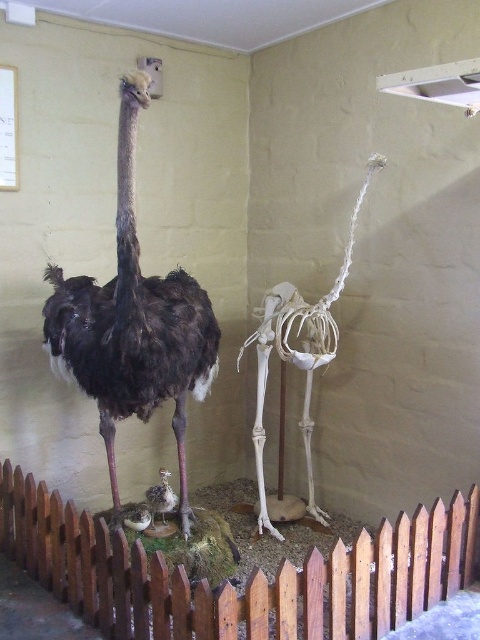
You are a gardener who needs to trim the brown wooden picket fence at lower center. However, you notice the dark brown feathers at center nearby. Which object is closer to the ground? Please state the name of the object closer to the ground.

The brown wooden picket fence at lower center is positioned under dark brown feathers at center, so the brown wooden picket fence at lower center is closer to the ground.

You are an ornithologist examining the image. You notice the dark brown feathers at center and the brown feathered chick at center. Which of these two objects is positioned higher in the image?

The dark brown feathers at center is above the brown feathered chick at center, so it is positioned higher in the image.

You are standing in front of the two ostrich displays. There are two points marked in the image. One is at coordinate point (194, 280) and the other at point (163, 483). Which point is closer to you?

Point (194, 280) is closer to you because it is further to the camera than point (163, 483).